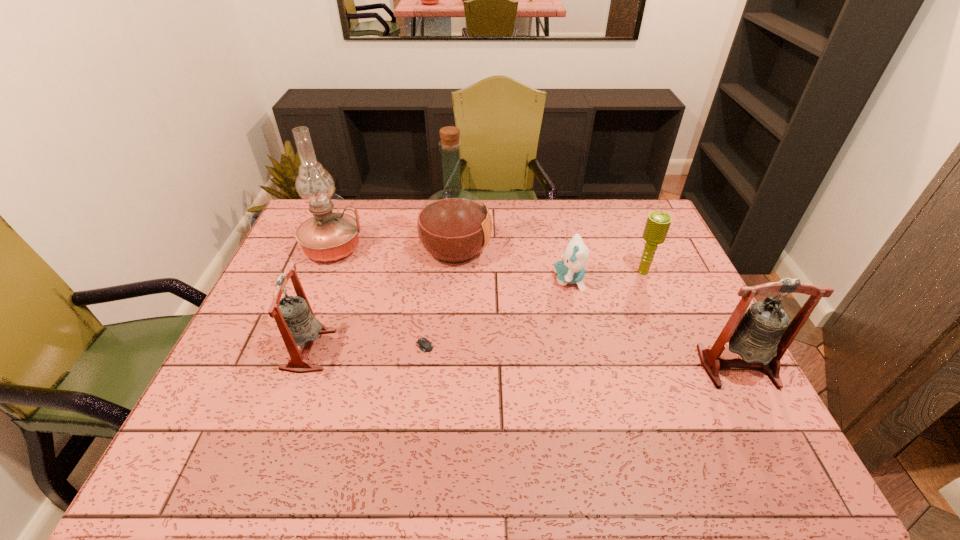
Where is `location for an additional bell to make spacing equal`? location for an additional bell to make spacing equal is located at coordinates (519, 358).